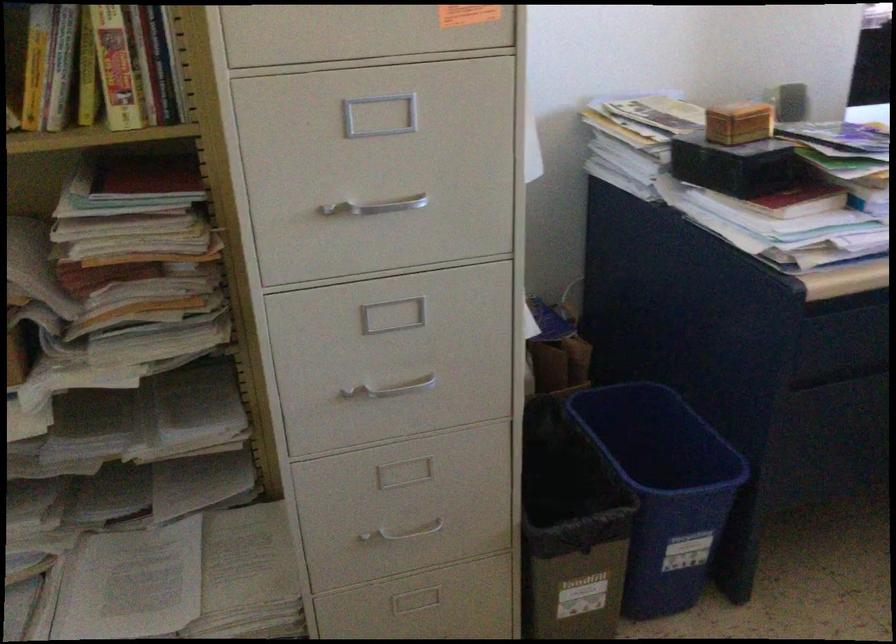
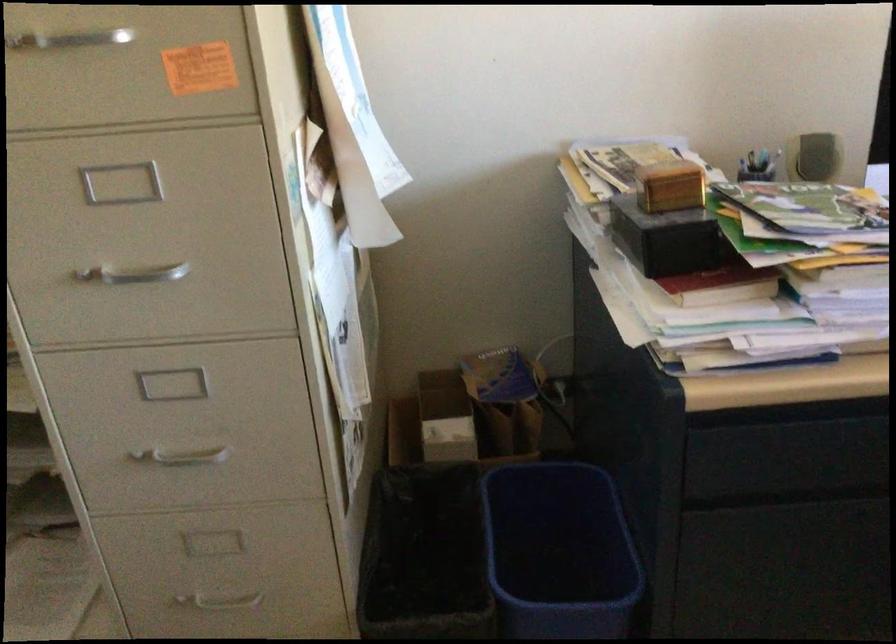
Where in the second image is the point corresponding to the point at 745,120 from the first image?

(669, 185)